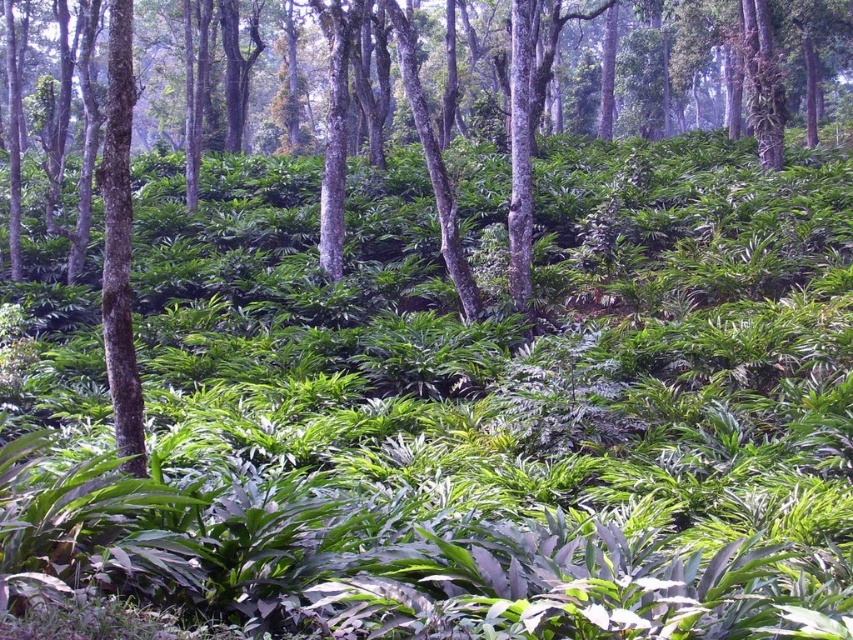
Question: Which point is closer to the camera?

Choices:
 (A) smooth bark tree at left
 (B) green leafy plant at center

Answer: (A)

Question: Is green leafy plant at center smaller than smooth bark tree at left?

Choices:
 (A) yes
 (B) no

Answer: (B)

Question: Does green leafy plant at center appear under smooth bark tree at left?

Choices:
 (A) yes
 (B) no

Answer: (B)

Question: Which object is farther from the camera taking this photo?

Choices:
 (A) green leafy plant at center
 (B) smooth bark tree at left

Answer: (A)

Question: Is green leafy plant at center above smooth bark tree at left?

Choices:
 (A) yes
 (B) no

Answer: (A)